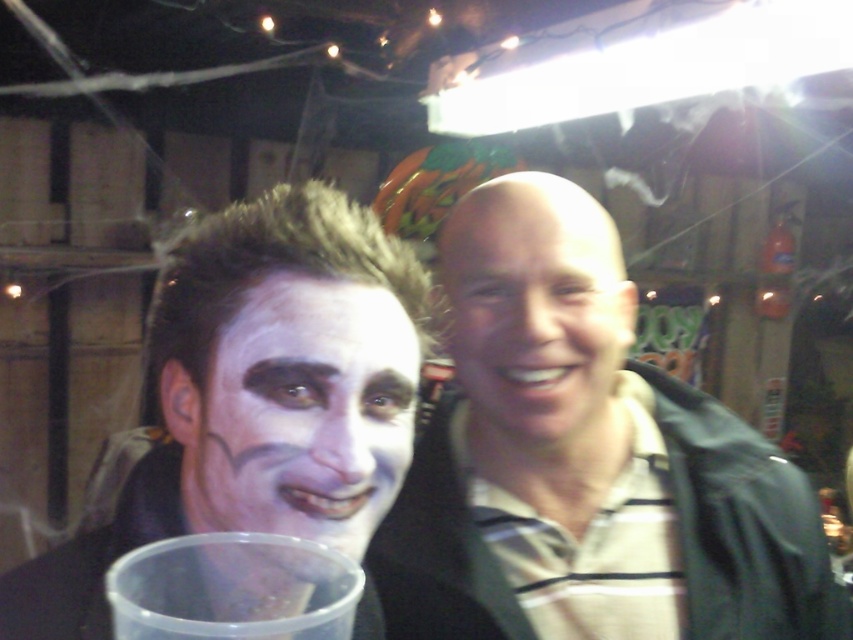
Question: Considering the relative positions of smooth skin face at center and clear plastic cup at lower left in the image provided, where is smooth skin face at center located with respect to clear plastic cup at lower left?

Choices:
 (A) left
 (B) right

Answer: (B)

Question: Which is farther from the white matte face paint at center?

Choices:
 (A) white matte face at center
 (B) clear plastic cup at lower left
 (C) smooth skin face at center

Answer: (C)

Question: Is white matte face paint at center below smooth skin face at center?

Choices:
 (A) yes
 (B) no

Answer: (A)

Question: Which object appears farthest from the camera in this image?

Choices:
 (A) clear plastic cup at lower left
 (B) matte black jacket at center
 (C) smooth skin face at center

Answer: (C)

Question: Is white matte face at center thinner than smooth skin face at center?

Choices:
 (A) yes
 (B) no

Answer: (A)

Question: Which of these objects is positioned farthest from the matte black jacket at center?

Choices:
 (A) smooth skin face at center
 (B) clear plastic cup at lower left
 (C) white matte face at center
 (D) white matte face paint at center

Answer: (B)